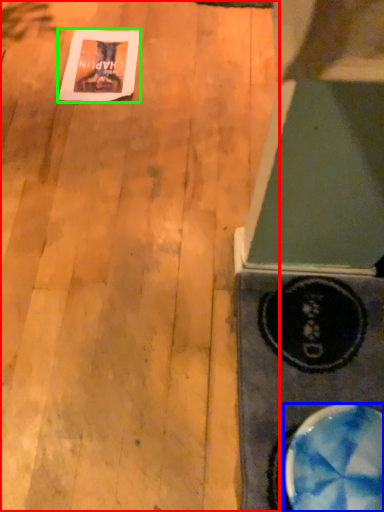
Question: Which object is the farthest from plywood (highlighted by a red box)? Choose among these: bowl (highlighted by a blue box) or postcard (highlighted by a green box).

Choices:
 (A) bowl
 (B) postcard

Answer: (A)